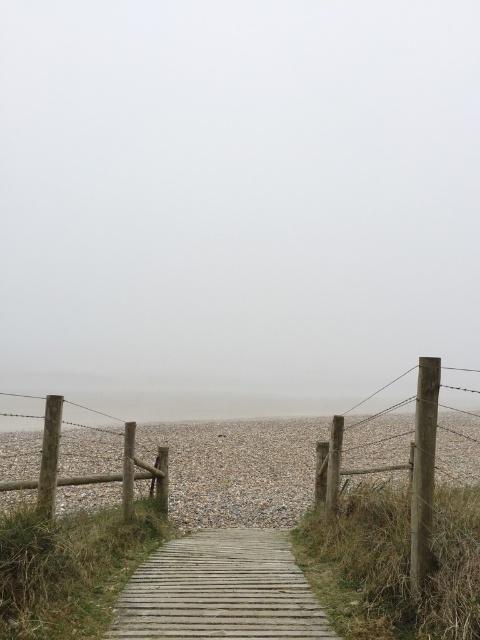
You are standing at the edge of the wooden boardwalk pathway and want to reach the gray gravel at center. Which direction should you walk to get there?

You should walk towards the center to reach the gray gravel at center.

Consider the image. You are a hiker who wants to cross the pebble beach. You see the wooden planks at center and the wooden fence at right. Which one is bigger in size?

The wooden planks at center is larger in size than wooden fence at right.